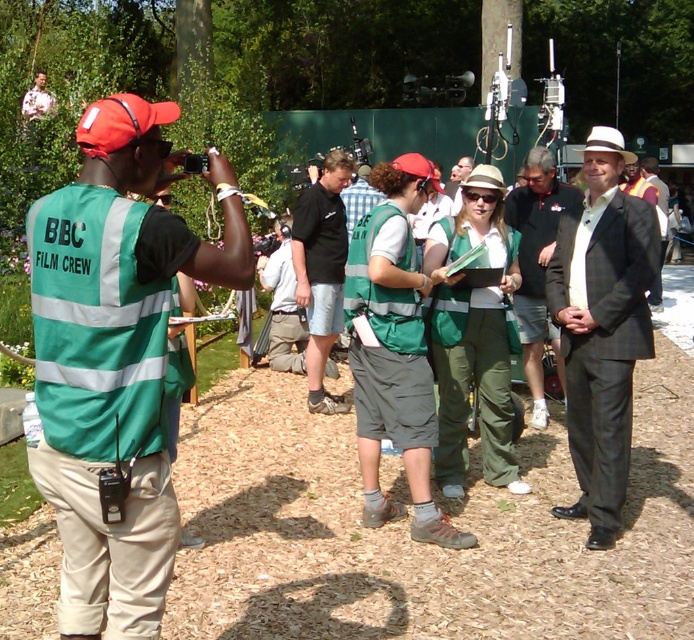
Question: Is green reflective vest at left in front of dark gray suit at center?

Choices:
 (A) yes
 (B) no

Answer: (A)

Question: Which point is closer to the camera?

Choices:
 (A) green reflective vest at left
 (B) dark gray suit at center
 (C) matte black suit at right
 (D) black cotton shirt at center

Answer: (A)

Question: Does green reflective vest at left have a larger size compared to matte black suit at right?

Choices:
 (A) no
 (B) yes

Answer: (A)

Question: Among these objects, which one is nearest to the camera?

Choices:
 (A) matte black suit at right
 (B) dark gray suit at center
 (C) black cotton shirt at center

Answer: (A)

Question: Is green reflective vest at left thinner than matte black suit at right?

Choices:
 (A) no
 (B) yes

Answer: (A)

Question: Which object is the farthest from the dark gray suit at center?

Choices:
 (A) green reflective vest at left
 (B) black cotton shirt at center
 (C) matte black suit at right

Answer: (A)